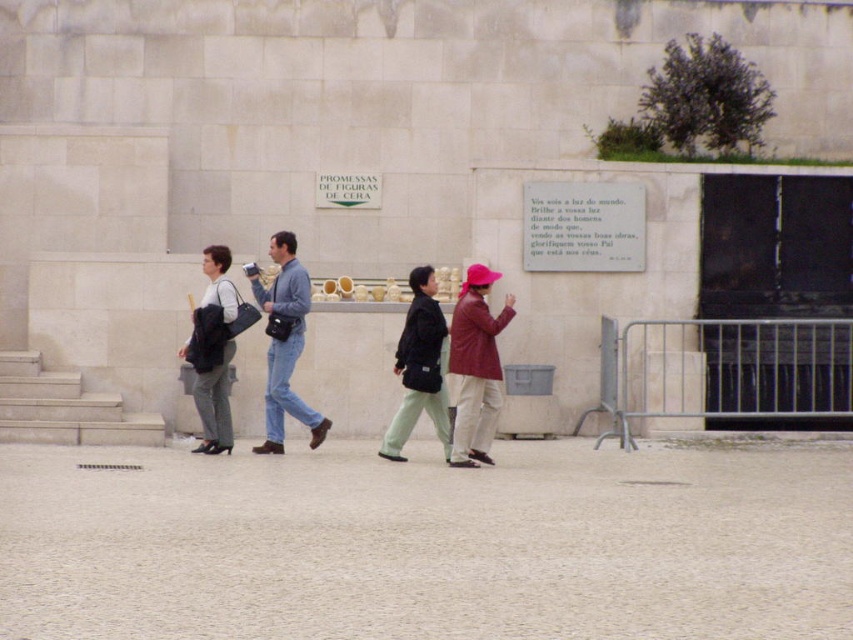
Question: Considering the real-world distances, which object is farthest from the denim jeans at center?

Choices:
 (A) matte pink hat at center
 (B) matte black bag at left
 (C) matte black jacket at center

Answer: (A)

Question: Is matte pink hat at center above matte black bag at left?

Choices:
 (A) yes
 (B) no

Answer: (B)

Question: Does denim jeans at center come behind matte black jacket at center?

Choices:
 (A) yes
 (B) no

Answer: (A)

Question: Is matte pink hat at center positioned in front of denim jeans at center?

Choices:
 (A) yes
 (B) no

Answer: (A)

Question: Estimate the real-world distances between objects in this image. Which object is closer to the matte pink hat at center?

Choices:
 (A) matte black bag at left
 (B) matte black jacket at center

Answer: (B)

Question: Which is nearer to the matte black bag at left?

Choices:
 (A) matte black jacket at center
 (B) denim jeans at center
 (C) matte pink hat at center

Answer: (B)